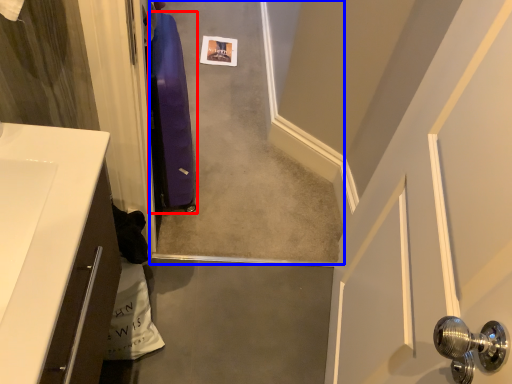
Question: Which of the following is the closest to the observer, luggage (highlighted by a red box) or concrete (highlighted by a blue box)?

Choices:
 (A) luggage
 (B) concrete

Answer: (A)